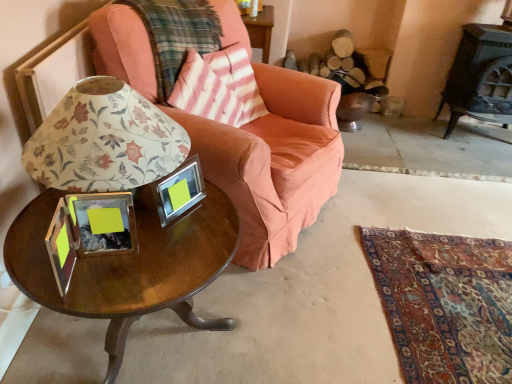
Question: Would you say pink striped fabric pillow at upper center is a long distance from floral paper lampshade at center?

Choices:
 (A) yes
 (B) no

Answer: (B)

Question: Is pink striped fabric pillow at upper center facing towards floral paper lampshade at center?

Choices:
 (A) no
 (B) yes

Answer: (A)

Question: Is pink striped fabric pillow at upper center outside floral paper lampshade at center?

Choices:
 (A) no
 (B) yes

Answer: (B)

Question: Can floral paper lampshade at center be found inside pink striped fabric pillow at upper center?

Choices:
 (A) yes
 (B) no

Answer: (B)

Question: Is pink striped fabric pillow at upper center positioned in front of floral paper lampshade at center?

Choices:
 (A) no
 (B) yes

Answer: (A)

Question: Does point (313, 160) appear closer or farther from the camera than point (173, 99)?

Choices:
 (A) farther
 (B) closer

Answer: (A)

Question: Is matte pink fabric chair at center in front of or behind pink striped fabric pillow at upper center in the image?

Choices:
 (A) front
 (B) behind

Answer: (A)

Question: Is matte pink fabric chair at center inside the boundaries of pink striped fabric pillow at upper center, or outside?

Choices:
 (A) inside
 (B) outside

Answer: (B)

Question: Considering the positions of matte pink fabric chair at center and pink striped fabric pillow at upper center in the image, is matte pink fabric chair at center taller or shorter than pink striped fabric pillow at upper center?

Choices:
 (A) short
 (B) tall

Answer: (B)

Question: Considering the positions of point (216, 264) and point (346, 105), is point (216, 264) closer or farther from the camera than point (346, 105)?

Choices:
 (A) farther
 (B) closer

Answer: (B)

Question: Relative to velvet orange swivel chair at center, is shiny brown wood coffee table at lower left in front or behind?

Choices:
 (A) front
 (B) behind

Answer: (A)

Question: Is shiny brown wood coffee table at lower left to the left or to the right of velvet orange swivel chair at center in the image?

Choices:
 (A) left
 (B) right

Answer: (A)

Question: Is shiny brown wood coffee table at lower left situated inside velvet orange swivel chair at center or outside?

Choices:
 (A) inside
 (B) outside

Answer: (B)

Question: Is shiny brown wood coffee table at lower left spatially inside pink striped fabric pillow at upper center, or outside of it?

Choices:
 (A) outside
 (B) inside

Answer: (A)

Question: From a real-world perspective, is shiny brown wood coffee table at lower left physically located above or below pink striped fabric pillow at upper center?

Choices:
 (A) below
 (B) above

Answer: (A)